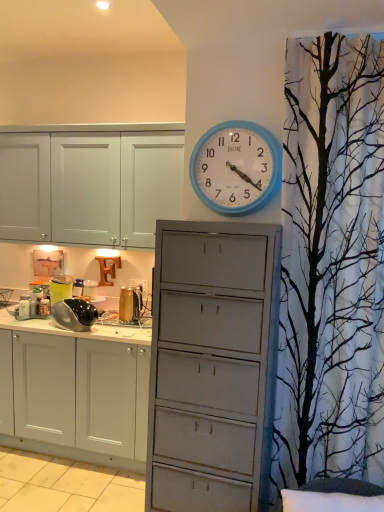
Question: Is point (62, 296) closer or farther from the camera than point (52, 315)?

Choices:
 (A) farther
 (B) closer

Answer: (A)

Question: In terms of height, does metallic silver pot at left, the first appliance when ordered from left to right, look taller or shorter compared to black glossy kettle at left, the 2th appliance in the right-to-left sequence?

Choices:
 (A) tall
 (B) short

Answer: (A)

Question: Considering the real-world distances, which object is closest to the gold metallic kettle at center, placed as the 3th appliance when sorted from left to right?

Choices:
 (A) metallic silver pot at left, placed as the 3th appliance when sorted from right to left
 (B) black glossy kettle at left, acting as the second appliance starting from the left
 (C) blue plastic wall clock at upper center

Answer: (B)

Question: Estimate the real-world distances between objects in this image. Which object is closer to the metallic silver pot at left, placed as the 3th appliance when sorted from right to left?

Choices:
 (A) blue plastic wall clock at upper center
 (B) gold metallic kettle at center, acting as the 1th appliance starting from the right
 (C) black glossy kettle at left, acting as the second appliance starting from the left

Answer: (C)